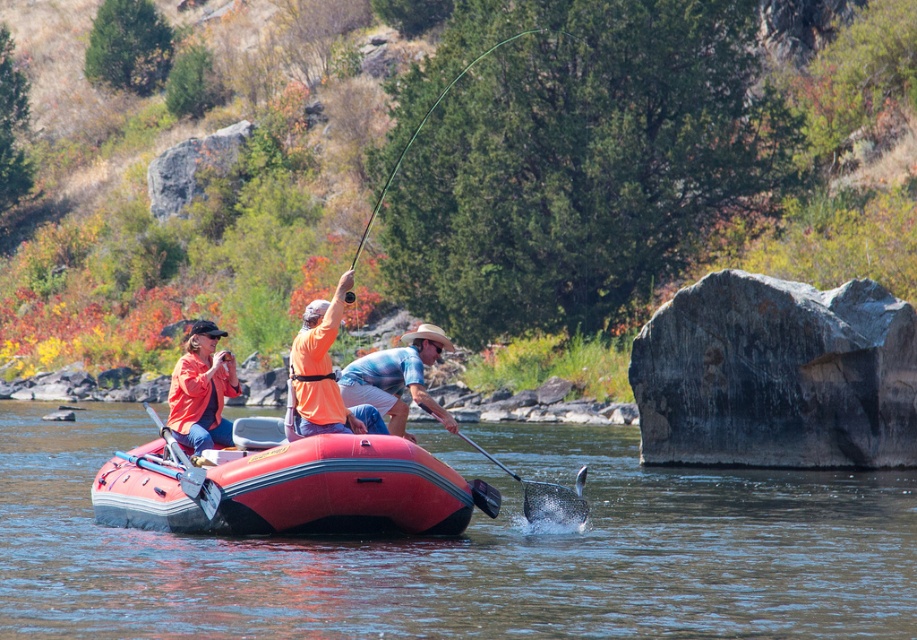
Question: Based on their relative distances, which object is nearer to the rubberized red raft at center?

Choices:
 (A) matte orange jacket at center
 (B) smooth rubber raft at center
 (C) orange matte life vest at center

Answer: (A)

Question: Can you confirm if smooth rubber raft at center is smaller than rubberized red raft at center?

Choices:
 (A) no
 (B) yes

Answer: (A)

Question: Which of the following is the closest to the observer?

Choices:
 (A) (382, 387)
 (B) (322, 356)
 (C) (337, 532)
 (D) (221, 406)

Answer: (C)

Question: Is rubberized red raft at center wider than blue tie-dye shirt at center?

Choices:
 (A) no
 (B) yes

Answer: (B)

Question: Among these points, which one is nearest to the camera?

Choices:
 (A) (339, 404)
 (B) (141, 484)
 (C) (186, 403)

Answer: (B)

Question: Can you confirm if smooth rubber raft at center is positioned to the right of matte orange jacket at center?

Choices:
 (A) yes
 (B) no

Answer: (A)